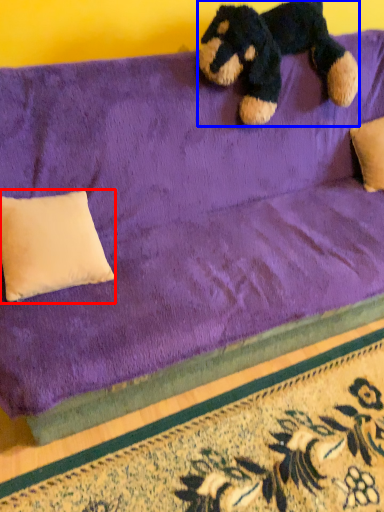
Question: Which object appears closest to the camera in this image, pillow (highlighted by a red box) or teddy bear (highlighted by a blue box)?

Choices:
 (A) pillow
 (B) teddy bear

Answer: (A)